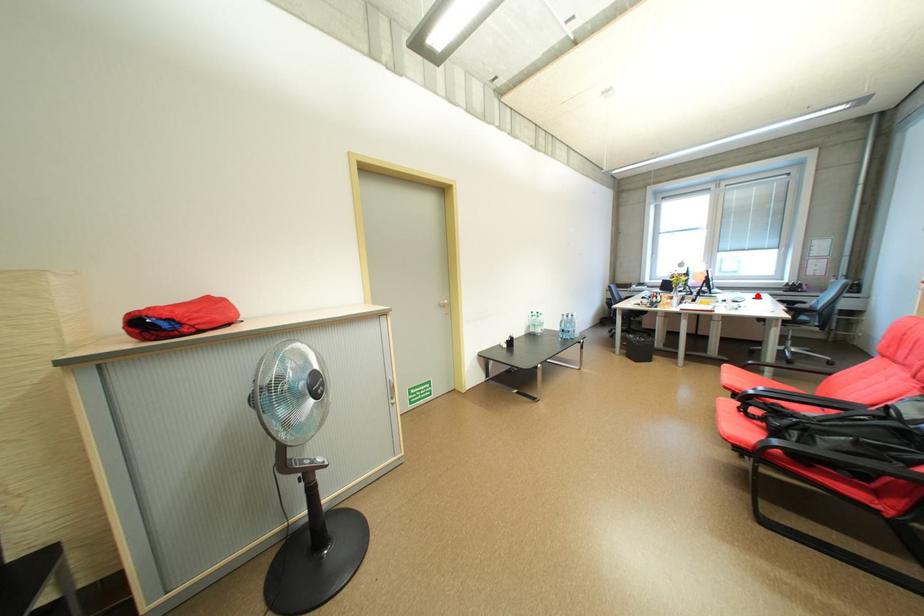
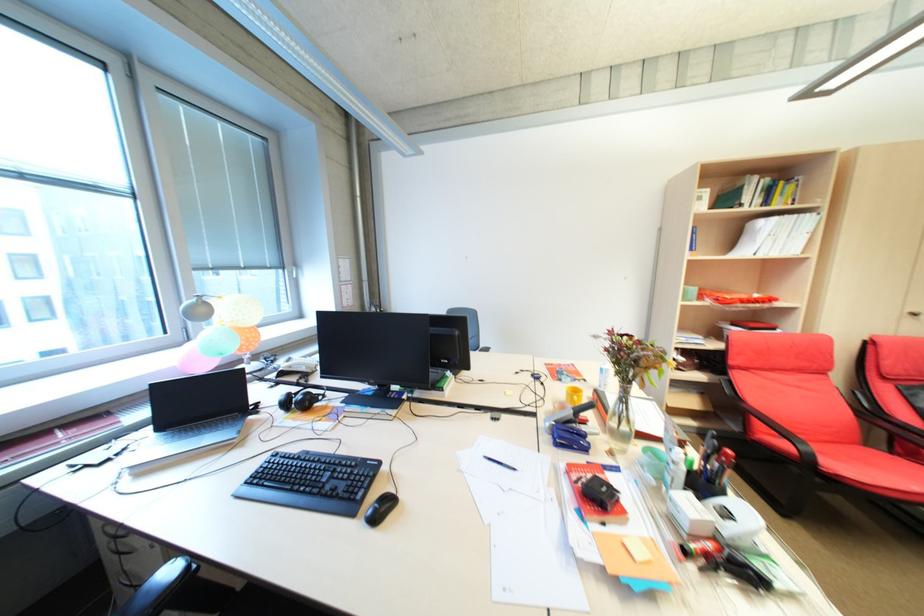
Question: I am providing you with two images of the same scene from different viewpoints. A red point is marked on the first image. Is the red point's position out of view in image 2?

Choices:
 (A) Yes
 (B) No

Answer: (A)